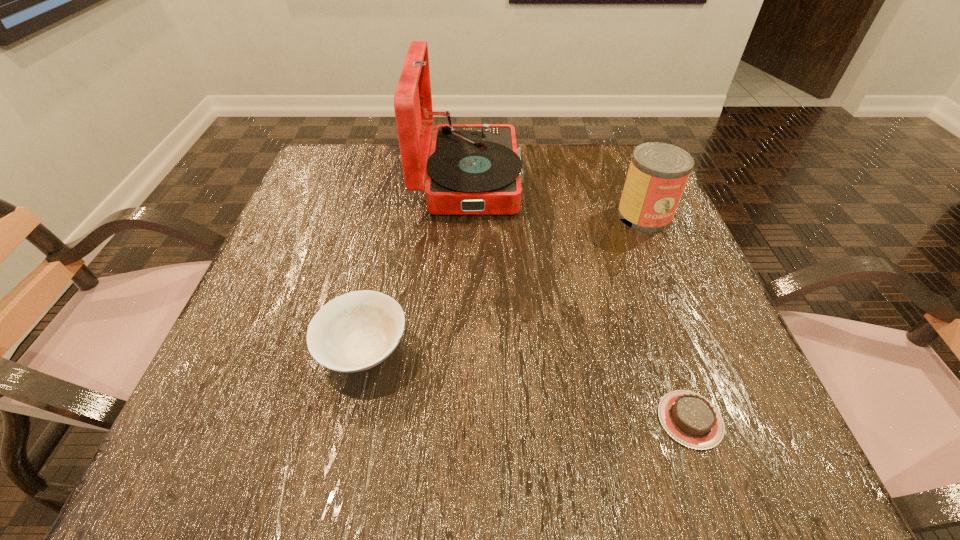
Identify the location of vacant space at the far left corner of the desktop. (372, 190).

Where is `free point at the near right corner`? This screenshot has height=540, width=960. free point at the near right corner is located at coordinates (690, 480).

Locate an element on the screen. free space between the phonograph_record and the second shortest object is located at coordinates coord(416,265).

In order to click on vacant area that lies between the chocolate cake and the tallest object in this screenshot , I will do `click(579, 299)`.

You are a GUI agent. You are given a task and a screenshot of the screen. Output one action in this format:
    pyautogui.click(x=<x>, y=<y>)
    Task: Click on the free space that is in between the tallest object and the chocolate cake
    The height and width of the screenshot is (540, 960).
    Given the screenshot: What is the action you would take?
    pyautogui.click(x=579, y=299)

What are the coordinates of `vacant area between the bowl and the tallest object` in the screenshot? It's located at (416, 265).

The image size is (960, 540). Identify the location of free space between the phonograph_record and the bowl. (416, 265).

I want to click on empty space between the bowl and the can, so click(x=504, y=282).

Identify the location of unoccupied area between the can and the shortest object. (667, 318).

Identify the location of free spot between the tallest object and the chocolate cake. (579, 299).